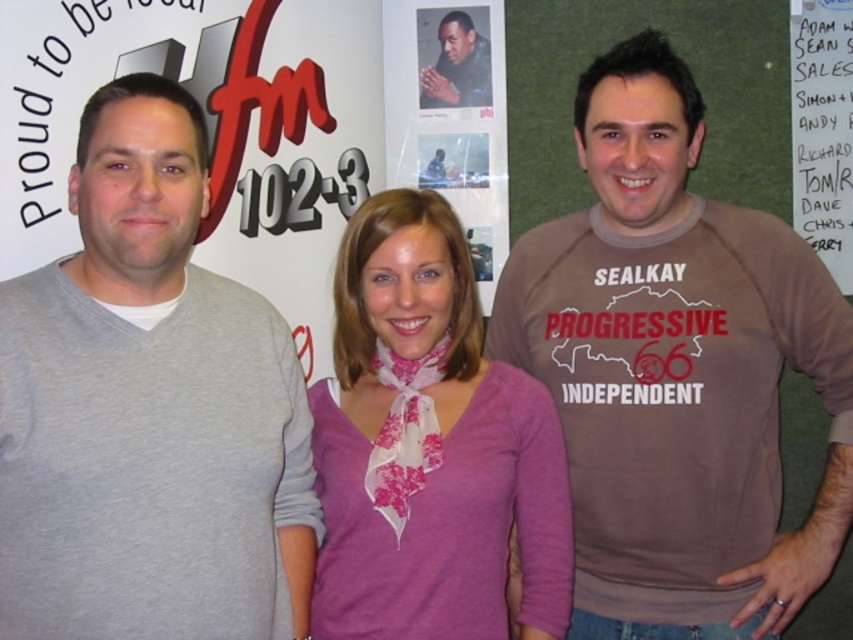
Which is more to the right, white paper at upper right or matte black jacket at center?

white paper at upper right

Is point (805, 96) less distant than point (437, 36)?

Yes, point (805, 96) is closer to viewer.

Locate an element on the screen. The height and width of the screenshot is (640, 853). white paper at upper right is located at coordinates (822, 131).

You are a GUI agent. You are given a task and a screenshot of the screen. Output one action in this format:
    pyautogui.click(x=<x>, y=<y>)
    Task: Click on the white paper at upper right
    The height and width of the screenshot is (640, 853).
    Given the screenshot: What is the action you would take?
    pyautogui.click(x=822, y=131)

Is point (372, 296) positioned before point (445, 44)?

Yes, point (372, 296) is closer to viewer.

Is pink fabric scarf at center above matte black jacket at center?

Actually, pink fabric scarf at center is below matte black jacket at center.

Locate an element on the screen. The width and height of the screenshot is (853, 640). pink fabric scarf at center is located at coordinates (430, 448).

Does gray cotton sweater at left appear under pink fabric scarf at center?

No, gray cotton sweater at left is not below pink fabric scarf at center.

Does point (142, 508) come behind point (323, 634)?

No, it is not.

Between point (132, 460) and point (381, 317), which one is positioned behind?

Positioned behind is point (381, 317).

Find the location of a particular element. The width and height of the screenshot is (853, 640). gray cotton sweater at left is located at coordinates (148, 410).